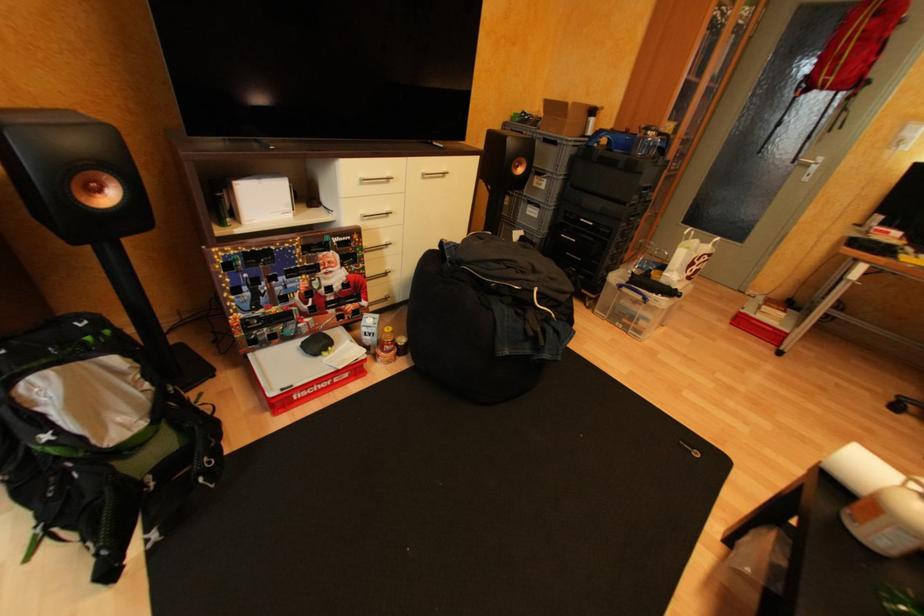
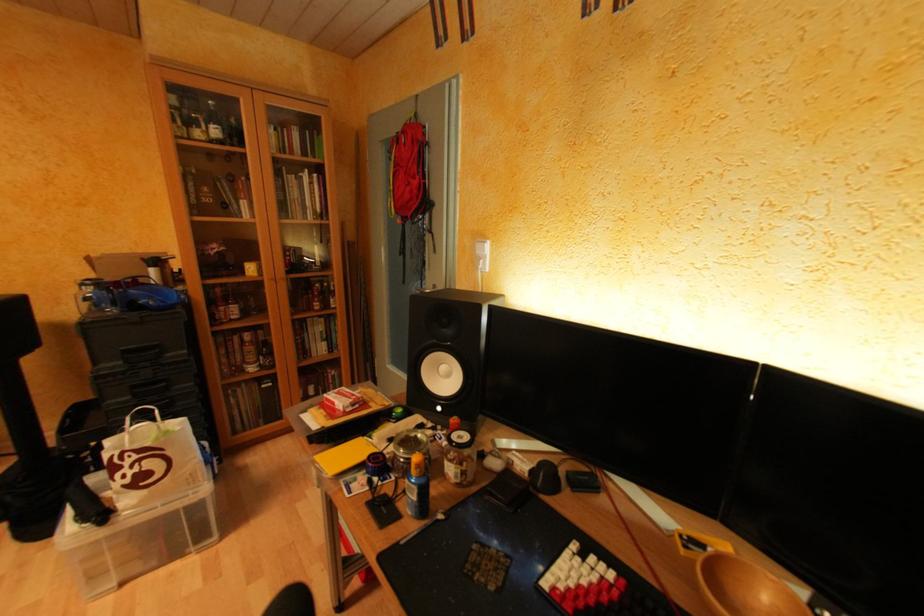
Question: Which direction would the cameraman need to move to produce the second image? Reply with the corresponding letter.

Choices:
 (A) Left
 (B) Right
 (C) Forward
 (D) Backward

Answer: (B)